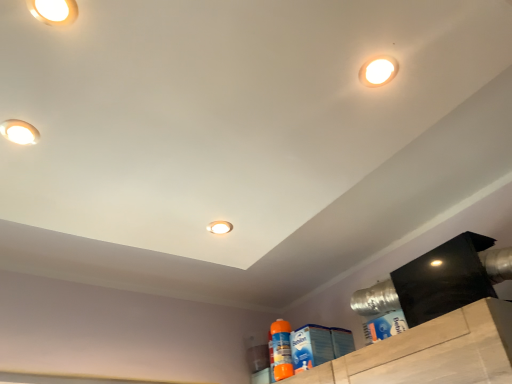
At what (x,y) coordinates should I click in order to perform the action: click on matte white droplight at upper left, which is counted as the fourth droplight, starting from the back. Please return your answer as a coordinate pair (x, y). Image resolution: width=512 pixels, height=384 pixels. Looking at the image, I should click on (54, 11).

Image resolution: width=512 pixels, height=384 pixels. Identify the location of white glossy droplight at upper right, the 2th droplight when ordered from top to bottom. pyautogui.click(x=378, y=71).

This screenshot has height=384, width=512. Identify the location of matte white droplight at center, the 2th droplight viewed from the right. (220, 227).

The image size is (512, 384). Identify the location of orange plastic spray bottle at lower right, which appears as the second cleaning product when viewed from the top. 281,349.

From a real-world perspective, is matte white droplight at upper left, the first droplight positioned from the left, on top of matte white droplight at upper left, which is counted as the fourth droplight, starting from the back?

Yes, from a real-world perspective, matte white droplight at upper left, the first droplight positioned from the left, is over matte white droplight at upper left, which is counted as the fourth droplight, starting from the back

Based on the photo, is matte white droplight at upper left, the 4th droplight when ordered from right to left, at the right side of matte white droplight at upper left, placed as the third droplight when sorted from right to left?

No.

Does matte white droplight at upper left, the first droplight positioned from the left, have a smaller size compared to matte white droplight at upper left, marked as the 4th droplight in a bottom-to-top arrangement?

Actually, matte white droplight at upper left, the first droplight positioned from the left, might be larger than matte white droplight at upper left, marked as the 4th droplight in a bottom-to-top arrangement.

Considering the points (17, 143) and (66, 4), which point is behind, point (17, 143) or point (66, 4)?

The point (17, 143) is behind.

How different are the orientations of matte white droplight at upper left, the first droplight positioned from the left, and matte white droplight at center, the third droplight viewed from the left, in degrees?

There is a 0.000141-degree angle between the facing directions of matte white droplight at upper left, the first droplight positioned from the left, and matte white droplight at center, the third droplight viewed from the left.

Where is `droplight that is below the matte white droplight at upper left, the second droplight when ordered from back to front (from the image's perspective)`? Image resolution: width=512 pixels, height=384 pixels. droplight that is below the matte white droplight at upper left, the second droplight when ordered from back to front (from the image's perspective) is located at coordinates (220, 227).

Consider the image. From a real-world perspective, which object rests below the other?

matte white droplight at center, the first droplight from the bottom, from a real-world perspective.

How much distance is there between matte white droplight at upper left, which appears as the 3th droplight when viewed from the top, and matte white droplight at center, the third droplight viewed from the left?

matte white droplight at upper left, which appears as the 3th droplight when viewed from the top, is 24.51 inches away from matte white droplight at center, the third droplight viewed from the left.

Is blue cardboard box at lower right, which is the 1th cleaning product from right to left, to the left of matte white droplight at center, placed as the fourth droplight when sorted from front to back, from the viewer's perspective?

In fact, blue cardboard box at lower right, which is the 1th cleaning product from right to left, is to the right of matte white droplight at center, placed as the fourth droplight when sorted from front to back.

Does blue cardboard box at lower right, positioned as the 2th cleaning product in back-to-front order, touch matte white droplight at center, placed as the fourth droplight when sorted from front to back?

No, blue cardboard box at lower right, positioned as the 2th cleaning product in back-to-front order, is not in contact with matte white droplight at center, placed as the fourth droplight when sorted from front to back.

From the image's perspective, is blue cardboard box at lower right, positioned as the 2th cleaning product in back-to-front order, above or below matte white droplight at center, the third droplight viewed from the left?

blue cardboard box at lower right, positioned as the 2th cleaning product in back-to-front order, is situated lower than matte white droplight at center, the third droplight viewed from the left, in the image.

Is white glossy droplight at upper right, which is counted as the second droplight, starting from the front, outside of matte white droplight at upper left, marked as the 4th droplight in a bottom-to-top arrangement?

Yes, white glossy droplight at upper right, which is counted as the second droplight, starting from the front, is outside of matte white droplight at upper left, marked as the 4th droplight in a bottom-to-top arrangement.

Is white glossy droplight at upper right, which is counted as the second droplight, starting from the front, to the left or to the right of matte white droplight at upper left, placed as the third droplight when sorted from right to left, in the image?

From the image, it's evident that white glossy droplight at upper right, which is counted as the second droplight, starting from the front, is to the right of matte white droplight at upper left, placed as the third droplight when sorted from right to left.

Is white glossy droplight at upper right, which appears as the 1th droplight when viewed from the right, positioned in front of matte white droplight at upper left, which is the 1th droplight from top to bottom?

No, white glossy droplight at upper right, which appears as the 1th droplight when viewed from the right, is behind matte white droplight at upper left, which is the 1th droplight from top to bottom.

Is white glossy droplight at upper right, which appears as the 1th droplight when viewed from the right, taller than matte white droplight at upper left, which is counted as the fourth droplight, starting from the back?

Yes.

Does matte white droplight at center, placed as the fourth droplight when sorted from front to back, have a smaller size compared to orange plastic spray bottle at lower right, which appears as the second cleaning product when viewed from the top?

Correct, matte white droplight at center, placed as the fourth droplight when sorted from front to back, occupies less space than orange plastic spray bottle at lower right, which appears as the second cleaning product when viewed from the top.

Starting from the orange plastic spray bottle at lower right, which is the 2th cleaning product from front to back, which droplight is the 1st one to the left? Please provide its 2D coordinates.

[(220, 227)]

Is matte white droplight at center, placed as the fourth droplight when sorted from front to back, shorter than orange plastic spray bottle at lower right, which appears as the second cleaning product when viewed from the top?

Indeed, matte white droplight at center, placed as the fourth droplight when sorted from front to back, has a lesser height compared to orange plastic spray bottle at lower right, which appears as the second cleaning product when viewed from the top.

Considering the sizes of matte white droplight at center, placed as the fourth droplight when sorted from top to bottom, and orange plastic spray bottle at lower right, the first cleaning product when ordered from left to right, in the image, is matte white droplight at center, placed as the fourth droplight when sorted from top to bottom, wider or thinner than orange plastic spray bottle at lower right, the first cleaning product when ordered from left to right,?

matte white droplight at center, placed as the fourth droplight when sorted from top to bottom, is thinner than orange plastic spray bottle at lower right, the first cleaning product when ordered from left to right.

Locate an element on the screen. the 2nd cleaning product below the white glossy droplight at upper right, the 2th droplight when ordered from top to bottom (from a real-world perspective) is located at coordinates (384, 326).

In the scene shown: Considering the relative positions of white glossy droplight at upper right, the 2th droplight when ordered from top to bottom, and blue cardboard box at lower right, which is counted as the second cleaning product, starting from the left, in the image provided, is white glossy droplight at upper right, the 2th droplight when ordered from top to bottom, to the left of blue cardboard box at lower right, which is counted as the second cleaning product, starting from the left, from the viewer's perspective?

Indeed, white glossy droplight at upper right, the 2th droplight when ordered from top to bottom, is positioned on the left side of blue cardboard box at lower right, which is counted as the second cleaning product, starting from the left.

Is white glossy droplight at upper right, arranged as the third droplight when ordered from the bottom, located outside blue cardboard box at lower right, the first cleaning product viewed from the front?

Yes.

Is white glossy droplight at upper right, which is counted as the second droplight, starting from the front, completely or partially outside of matte white droplight at upper left, which appears as the 3th droplight when viewed from the top?

Yes, white glossy droplight at upper right, which is counted as the second droplight, starting from the front, is not within matte white droplight at upper left, which appears as the 3th droplight when viewed from the top.

Between white glossy droplight at upper right, which appears as the third droplight when viewed from the back, and matte white droplight at upper left, which is the 2th droplight in bottom-to-top order, which one appears on the right side from the viewer's perspective?

Positioned to the right is white glossy droplight at upper right, which appears as the third droplight when viewed from the back.

From their relative heights in the image, would you say white glossy droplight at upper right, which appears as the 1th droplight when viewed from the right, is taller or shorter than matte white droplight at upper left, the second droplight when ordered from back to front?

In the image, white glossy droplight at upper right, which appears as the 1th droplight when viewed from the right, appears to be taller than matte white droplight at upper left, the second droplight when ordered from back to front.

From a real-world perspective, is white glossy droplight at upper right, which is counted as the second droplight, starting from the front, positioned above or below matte white droplight at upper left, the second droplight when ordered from back to front?

From a real-world perspective, white glossy droplight at upper right, which is counted as the second droplight, starting from the front, is physically above matte white droplight at upper left, the second droplight when ordered from back to front.

Identify the location of droplight that is on the left side of matte white droplight at upper left, marked as the 1th droplight in a front-to-back arrangement. (19, 132).

Identify the location of droplight that is the 2nd object directly below the matte white droplight at upper left, the 4th droplight when ordered from right to left (from a real-world perspective). (220, 227).

Looking at the image, which one is located further to matte white droplight at upper left, which is the 1th droplight from top to bottom, blue cardboard box at lower right, which is the 1th cleaning product from right to left, or white glossy droplight at upper right, which is counted as the second droplight, starting from the front?

blue cardboard box at lower right, which is the 1th cleaning product from right to left, is positioned further to the anchor matte white droplight at upper left, which is the 1th droplight from top to bottom.

Based on the photo, looking at the image, which one is located closer to matte white droplight at upper left, which is counted as the fourth droplight, starting from the back, matte white droplight at center, the third droplight viewed from the left, or white glossy droplight at upper right, which appears as the third droplight when viewed from the back?

Based on the image, white glossy droplight at upper right, which appears as the third droplight when viewed from the back, appears to be nearer to matte white droplight at upper left, which is counted as the fourth droplight, starting from the back.

When comparing their distances from white glossy droplight at upper right, which appears as the 1th droplight when viewed from the right, does matte white droplight at upper left, which appears as the 3th droplight when viewed from the front, or matte white droplight at center, the third droplight viewed from the left, seem closer?

Among the two, matte white droplight at center, the third droplight viewed from the left, is located nearer to white glossy droplight at upper right, which appears as the 1th droplight when viewed from the right.

When comparing their distances from matte white droplight at upper left, marked as the 4th droplight in a bottom-to-top arrangement, does matte white droplight at upper left, which appears as the 3th droplight when viewed from the front, or matte white droplight at center, the 2th droplight viewed from the right, seem closer?

matte white droplight at upper left, which appears as the 3th droplight when viewed from the front, lies closer to matte white droplight at upper left, marked as the 4th droplight in a bottom-to-top arrangement, than the other object.

Estimate the real-world distances between objects in this image. Which object is further from matte white droplight at upper left, which appears as the 3th droplight when viewed from the top, white glossy droplight at upper right, which is counted as the second droplight, starting from the front, or blue cardboard box at lower right, positioned as the 2th cleaning product in back-to-front order?

blue cardboard box at lower right, positioned as the 2th cleaning product in back-to-front order, lies further to matte white droplight at upper left, which appears as the 3th droplight when viewed from the top, than the other object.

Considering their positions, is matte white droplight at upper left, which is the 1th droplight from top to bottom, positioned closer to white glossy droplight at upper right, which appears as the 1th droplight when viewed from the right, than blue cardboard box at lower right, positioned as the 2th cleaning product in back-to-front order?

matte white droplight at upper left, which is the 1th droplight from top to bottom, is positioned closer to the anchor white glossy droplight at upper right, which appears as the 1th droplight when viewed from the right.

Which object lies nearer to the anchor point orange plastic spray bottle at lower right, the second cleaning product when ordered from right to left, matte white droplight at center, the third droplight viewed from the left, or blue cardboard box at lower right, which is counted as the second cleaning product, starting from the left?

The object closer to orange plastic spray bottle at lower right, the second cleaning product when ordered from right to left, is blue cardboard box at lower right, which is counted as the second cleaning product, starting from the left.

When comparing their distances from white glossy droplight at upper right, which is counted as the second droplight, starting from the front, does matte white droplight at center, the first droplight in the back-to-front sequence, or blue cardboard box at lower right, positioned as the 2th cleaning product in back-to-front order, seem closer?

Among the two, matte white droplight at center, the first droplight in the back-to-front sequence, is located nearer to white glossy droplight at upper right, which is counted as the second droplight, starting from the front.

I want to click on cleaning product between matte white droplight at upper left, which appears as the 3th droplight when viewed from the front, and blue cardboard box at lower right, placed as the 2th cleaning product when sorted from bottom to top, from left to right, so click(x=281, y=349).

Find the location of `cleaning product between white glossy droplight at upper right, which appears as the third droplight when viewed from the back, and orange plastic spray bottle at lower right, the first cleaning product when ordered from left to right, in the up-down direction`. cleaning product between white glossy droplight at upper right, which appears as the third droplight when viewed from the back, and orange plastic spray bottle at lower right, the first cleaning product when ordered from left to right, in the up-down direction is located at coordinates (384, 326).

Find the location of a particular element. cleaning product between matte white droplight at upper left, placed as the third droplight when sorted from right to left, and orange plastic spray bottle at lower right, which appears as the second cleaning product when viewed from the top, in the up-down direction is located at coordinates (384, 326).

You are a GUI agent. You are given a task and a screenshot of the screen. Output one action in this format:
    pyautogui.click(x=<x>, y=<y>)
    Task: Click on the cleaning product located between matte white droplight at center, the 2th droplight viewed from the right, and blue cardboard box at lower right, which is counted as the second cleaning product, starting from the left, in the left-right direction
    
    Given the screenshot: What is the action you would take?
    pyautogui.click(x=281, y=349)